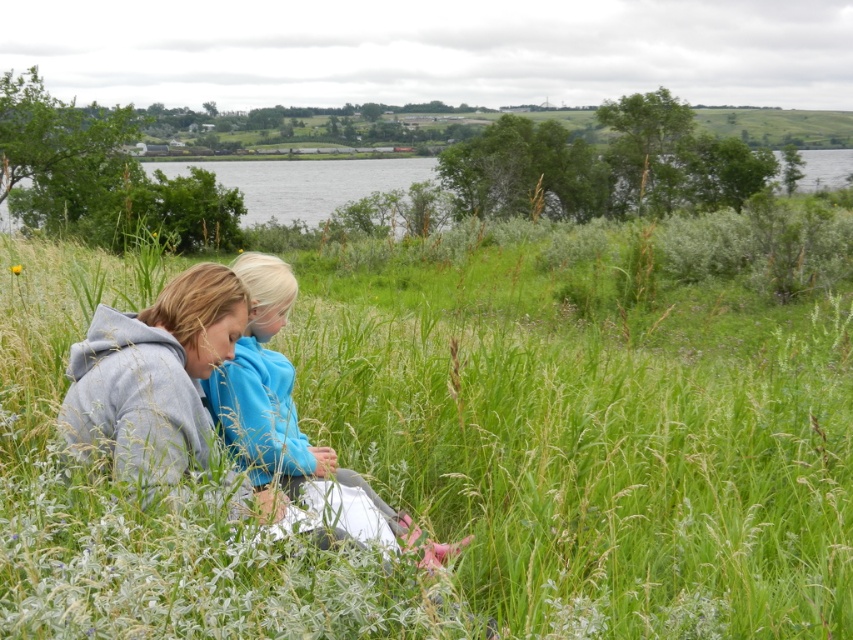
Does green grass at center have a greater width compared to blue fleece jacket at lower left?

Yes, green grass at center is wider than blue fleece jacket at lower left.

This screenshot has width=853, height=640. I want to click on green grass at center, so click(463, 467).

Where is `green grass at center`? The image size is (853, 640). green grass at center is located at coordinates (463, 467).

Which is behind, point (312, 467) or point (15, 273)?

Point (15, 273)

Identify the location of blue fleece jacket at lower left. (276, 397).

Which of these two, green grass at center or yellow matte flower at center, stands taller?

green grass at center is taller.

Which is in front, point (376, 372) or point (16, 266)?

Point (376, 372) is more forward.

Find the location of a particular element. The image size is (853, 640). green grass at center is located at coordinates (463, 467).